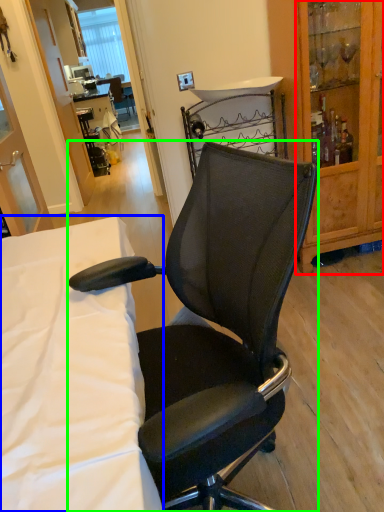
Question: Estimate the real-world distances between objects in this image. Which object is farther from cabinetry (highlighted by a red box), desk (highlighted by a blue box) or chair (highlighted by a green box)?

Choices:
 (A) desk
 (B) chair

Answer: (A)